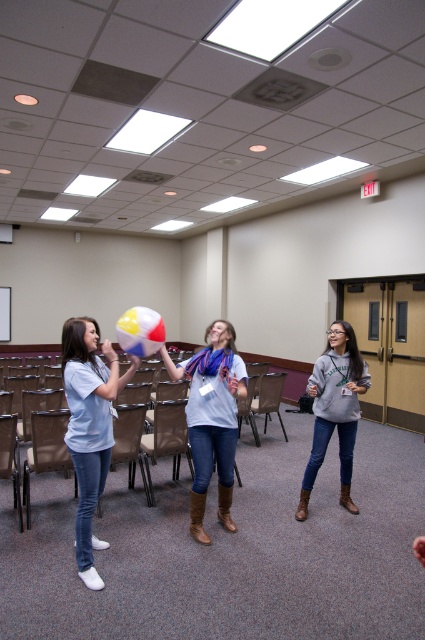
Question: Which is farther from the multicolored fabric beach ball at center?

Choices:
 (A) matte white scarf at center
 (B) gray fleece sweatshirt at right

Answer: (B)

Question: Can you confirm if matte white scarf at center is positioned above brown fabric chair at center?

Choices:
 (A) no
 (B) yes

Answer: (B)

Question: Among these objects, which one is nearest to the camera?

Choices:
 (A) matte white scarf at center
 (B) matte blue shirt at left

Answer: (B)

Question: Does matte blue shirt at left have a larger size compared to brown leather chair at center?

Choices:
 (A) yes
 (B) no

Answer: (A)

Question: Which of the following is the farthest from the observer?

Choices:
 (A) (64, 356)
 (B) (285, 436)

Answer: (B)

Question: Is matte blue shirt at left behind brown leather chair at center?

Choices:
 (A) no
 (B) yes

Answer: (A)